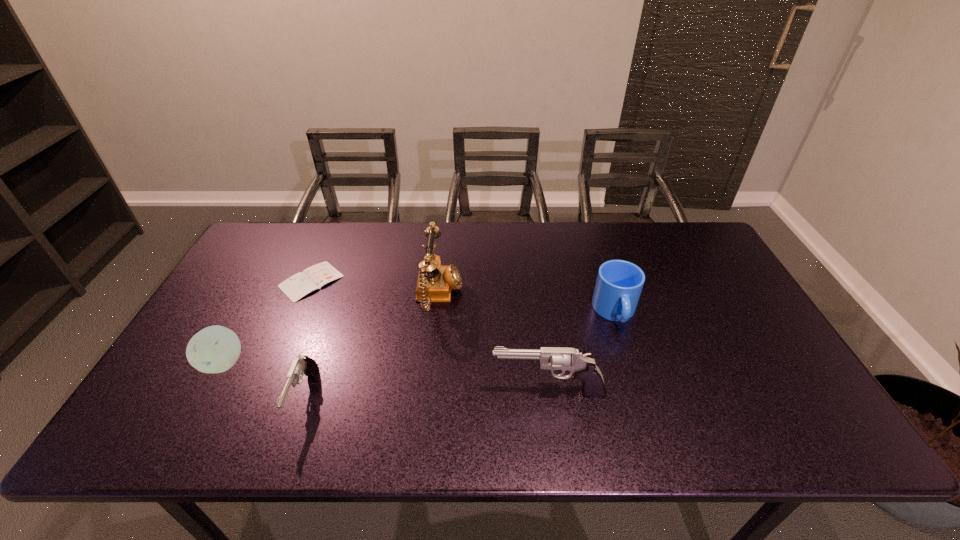
The height and width of the screenshot is (540, 960). In order to click on object present at the near left corner in this screenshot , I will do `click(215, 349)`.

In the image, there is a desktop. Where is `free space at the far edge`? The image size is (960, 540). free space at the far edge is located at coordinates (302, 241).

In the image, there is a desktop. Where is `vacant space at the near edge`? vacant space at the near edge is located at coordinates [x=438, y=395].

At what (x,y) coordinates should I click in order to perform the action: click on free region at the left edge. Please return your answer as a coordinate pair (x, y). This screenshot has height=540, width=960. Looking at the image, I should click on (220, 302).

At what (x,y) coordinates should I click in order to perform the action: click on free spot at the right edge of the desktop. Please return your answer as a coordinate pair (x, y). Image resolution: width=960 pixels, height=540 pixels. Looking at the image, I should click on (767, 359).

Image resolution: width=960 pixels, height=540 pixels. In the image, there is a desktop. What are the coordinates of `vacant space at the far left corner` in the screenshot? It's located at (304, 228).

This screenshot has width=960, height=540. In order to click on free space between the mug and the apple in this screenshot , I will do coord(420,338).

Find the location of a particular element. The image size is (960, 540). vacant space that's between the apple and the rightmost object is located at coordinates (420, 338).

Find the location of a particular element. The image size is (960, 540). empty location between the left gun and the diary is located at coordinates (307, 339).

I want to click on free space that is in between the shortest object and the left gun, so click(x=307, y=339).